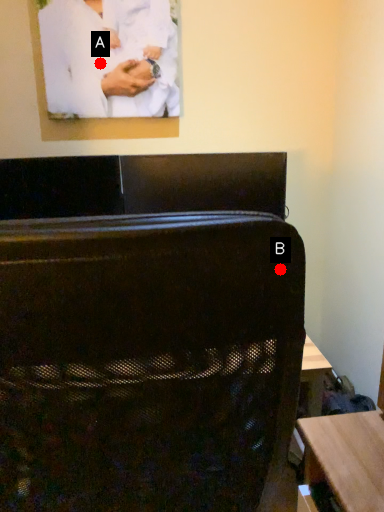
Question: Two points are circled on the image, labeled by A and B beside each circle. Which point appears farthest from the camera in this image?

Choices:
 (A) A is further
 (B) B is further

Answer: (A)